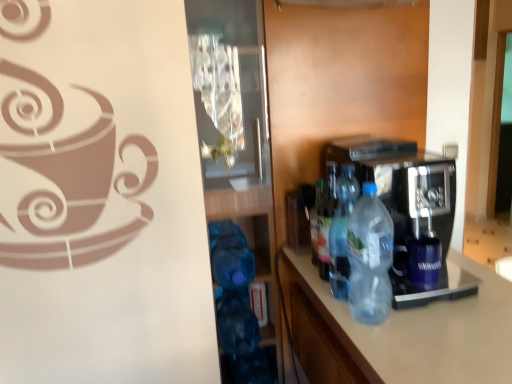
Question: Is translucent plastic bottle at center, the third bottle positioned from the front, smaller than translucent plastic bottle at center, which is the 3th bottle from back to front?

Choices:
 (A) yes
 (B) no

Answer: (A)

Question: Is translucent plastic bottle at center, placed as the first bottle when sorted from back to front, positioned before translucent plastic bottle at center, which is the 3th bottle from back to front?

Choices:
 (A) yes
 (B) no

Answer: (B)

Question: Is translucent plastic bottle at center, which is the 3th bottle from back to front, inside translucent plastic bottle at center, placed as the first bottle when sorted from back to front?

Choices:
 (A) no
 (B) yes

Answer: (A)

Question: Is translucent plastic bottle at center, the third bottle positioned from the front, far away from translucent plastic bottle at center, which is the 3th bottle from back to front?

Choices:
 (A) yes
 (B) no

Answer: (B)

Question: Could you tell me if translucent plastic bottle at center, placed as the first bottle when sorted from back to front, is turned towards translucent plastic bottle at center, positioned as the 1th bottle in front-to-back order?

Choices:
 (A) yes
 (B) no

Answer: (A)

Question: Based on their sizes in the image, would you say translucent plastic bottle at center, the third bottle positioned from the front, is bigger or smaller than transparent glass door at center?

Choices:
 (A) big
 (B) small

Answer: (B)

Question: In terms of width, does translucent plastic bottle at center, the third bottle positioned from the front, look wider or thinner when compared to transparent glass door at center?

Choices:
 (A) wide
 (B) thin

Answer: (B)

Question: Is translucent plastic bottle at center, the third bottle positioned from the front, to the left or to the right of transparent glass door at center in the image?

Choices:
 (A) right
 (B) left

Answer: (A)

Question: Is point (327, 205) closer or farther from the camera than point (211, 175)?

Choices:
 (A) farther
 (B) closer

Answer: (B)

Question: Based on their positions, is translucent plastic bottle at center, which is the 3th bottle from back to front, located to the left or right of transparent plastic coffee machine at center?

Choices:
 (A) right
 (B) left

Answer: (B)

Question: In terms of width, does translucent plastic bottle at center, positioned as the 1th bottle in front-to-back order, look wider or thinner when compared to transparent plastic coffee machine at center?

Choices:
 (A) wide
 (B) thin

Answer: (B)

Question: From the image's perspective, relative to transparent plastic coffee machine at center, is translucent plastic bottle at center, which is the 3th bottle from back to front, above or below?

Choices:
 (A) above
 (B) below

Answer: (B)

Question: Is point (355, 208) positioned closer to the camera than point (355, 172)?

Choices:
 (A) farther
 (B) closer

Answer: (B)

Question: From their relative heights in the image, would you say translucent plastic bottle at center, which is the 3th bottle from back to front, is taller or shorter than transparent glass door at center?

Choices:
 (A) short
 (B) tall

Answer: (A)

Question: Looking at their shapes, would you say translucent plastic bottle at center, which is the 3th bottle from back to front, is wider or thinner than transparent glass door at center?

Choices:
 (A) thin
 (B) wide

Answer: (A)